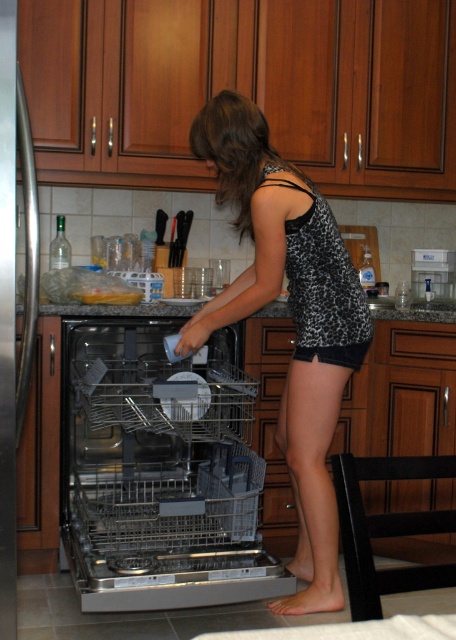
You are a home inspector assessing the kitchen layout. The dishwasher needs to be accessible for maintenance. Since the metallic gray dishwasher at center is under the black leopard print tank top at center, could this arrangement potentially block access to the dishwasher?

The metallic gray dishwasher at center is positioned under the black leopard print tank top at center, so yes, this arrangement could potentially block access to the dishwasher as the tank top is above it.

You are trying to determine if the metallic gray dishwasher at center can fit through a doorway that is the same width as the black leopard print tank top at center. Based on their sizes, can the dishwasher fit through the doorway?

The metallic gray dishwasher at center is wider than the black leopard print tank top at center, so it cannot fit through the doorway of the same width as the tank top.